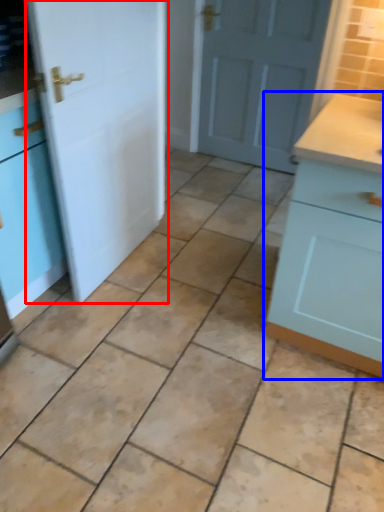
Question: Which of the following is the farthest to the observer, door (highlighted by a red box) or cabinetry (highlighted by a blue box)?

Choices:
 (A) door
 (B) cabinetry

Answer: (A)